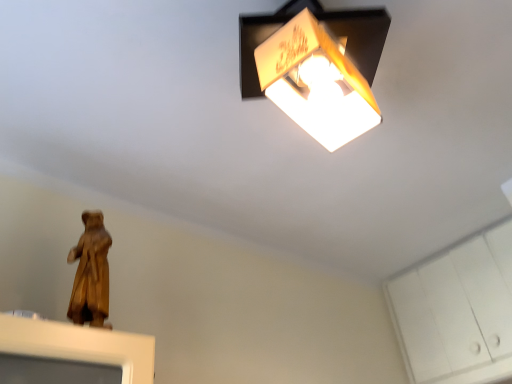
Question: Considering the relative positions of white matte cabinet at lower right and wooden statue at lower left in the image provided, is white matte cabinet at lower right behind wooden statue at lower left?

Choices:
 (A) no
 (B) yes

Answer: (B)

Question: Is white matte cabinet at lower right facing towards wooden statue at lower left?

Choices:
 (A) no
 (B) yes

Answer: (B)

Question: Can you confirm if white matte cabinet at lower right is smaller than wooden statue at lower left?

Choices:
 (A) yes
 (B) no

Answer: (B)

Question: Is white matte cabinet at lower right to the right of wooden statue at lower left from the viewer's perspective?

Choices:
 (A) yes
 (B) no

Answer: (A)

Question: From a real-world perspective, is white matte cabinet at lower right beneath wooden statue at lower left?

Choices:
 (A) no
 (B) yes

Answer: (A)

Question: Would you say wooden statue at lower left is part of white matte cabinet at lower right's contents?

Choices:
 (A) yes
 (B) no

Answer: (B)

Question: Is wooden statue at lower left next to white matte cabinet at lower right and touching it?

Choices:
 (A) no
 (B) yes

Answer: (A)

Question: Does wooden statue at lower left have a smaller size compared to white matte cabinet at lower right?

Choices:
 (A) yes
 (B) no

Answer: (A)

Question: Can you confirm if wooden statue at lower left is taller than white matte cabinet at lower right?

Choices:
 (A) no
 (B) yes

Answer: (A)

Question: Can we say wooden statue at lower left lies outside white matte cabinet at lower right?

Choices:
 (A) yes
 (B) no

Answer: (A)

Question: Is the depth of wooden statue at lower left less than that of white matte cabinet at lower right?

Choices:
 (A) no
 (B) yes

Answer: (B)

Question: Is wooden statue at lower left oriented away from white matte cabinet at lower right?

Choices:
 (A) yes
 (B) no

Answer: (B)

Question: From the image's perspective, is wooden statue at lower left located above or below white matte cabinet at lower right?

Choices:
 (A) above
 (B) below

Answer: (A)